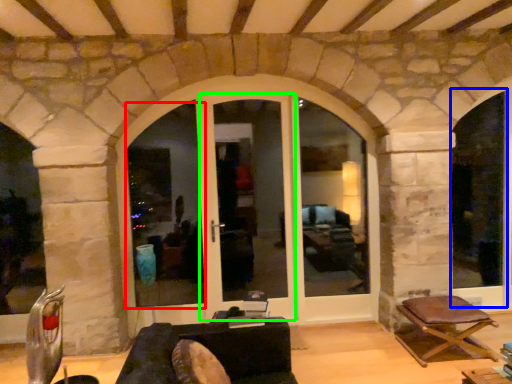
Question: Considering the real-world distances, which object is closest to window frame (highlighted by a red box)? window frame (highlighted by a blue box) or screen door (highlighted by a green box).

Choices:
 (A) window frame
 (B) screen door

Answer: (B)